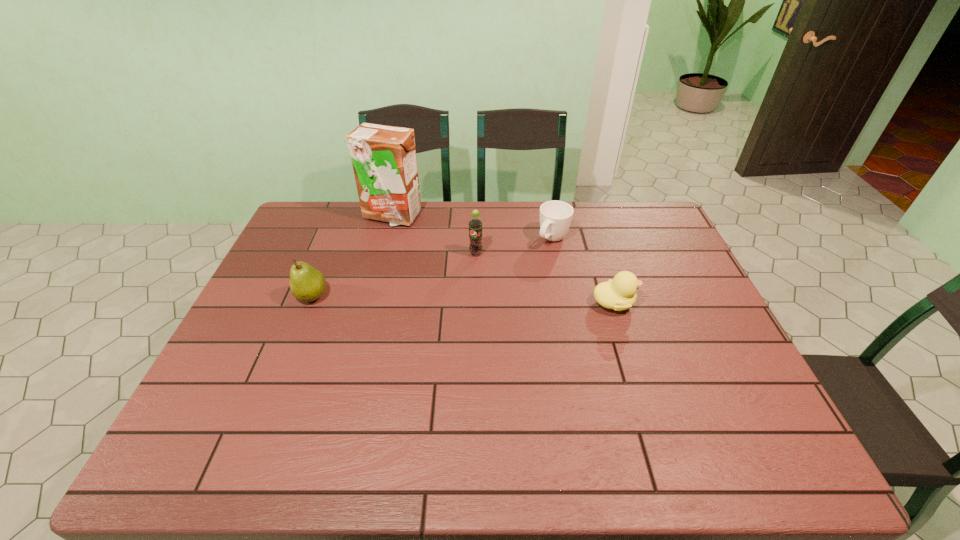
You are a GUI agent. You are given a task and a screenshot of the screen. Output one action in this format:
    pyautogui.click(x=<x>, y=<y>)
    Task: Click on the free space on the desktop that is between the leftmost object and the rightmost object and is positioned with the handle on the side of the cup
    
    Given the screenshot: What is the action you would take?
    pyautogui.click(x=501, y=301)

Where is `free space on the desktop that is between the third tallest object and the duckling and is positioned on the front label of the second tallest object`? This screenshot has width=960, height=540. free space on the desktop that is between the third tallest object and the duckling and is positioned on the front label of the second tallest object is located at coordinates (446, 299).

Where is `vacant space on the desktop that is between the leftmost object and the duckling and is positioned on the straw side of the tallest object`? The height and width of the screenshot is (540, 960). vacant space on the desktop that is between the leftmost object and the duckling and is positioned on the straw side of the tallest object is located at coordinates (440, 299).